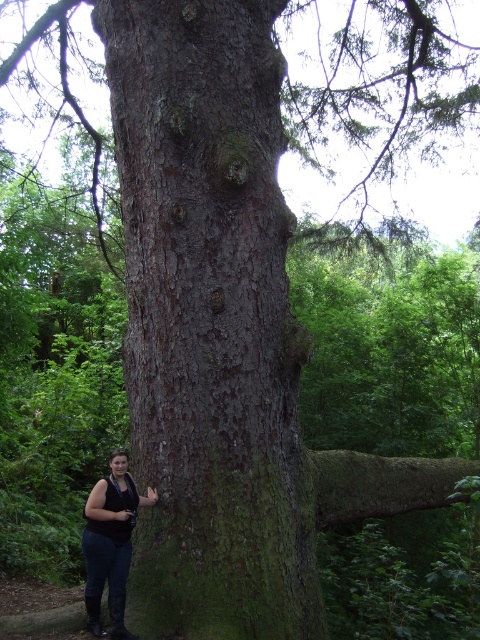
Looking at this image, you are standing in front of a large tree trunk with rough bark. There is a point marked at coordinates (211, 320). Based on the scene description, what part of the tree does this point most likely lie on?

The point at (211, 320) is on the dark brown rough bark at center, which is part of the large tree trunk described in the scene.

You are standing in a forest and see the dark brown rough bark at center and the matte black vest at lower left. Which object is positioned to the right side?

The dark brown rough bark at center is positioned to the right of the matte black vest at lower left.

You are a hiker who wants to take a photo of the dark brown rough bark at center and the matte black vest at lower left. Since you have a camera with a fixed focal length, you need to adjust your position to ensure both objects are in the frame. Considering their heights, which object should you focus on to include both in your shot?

The dark brown rough bark at center has a greater height compared to the matte black vest at lower left. To include both in the frame, you should focus on the dark brown rough bark at center since it is taller and requires a wider angle to capture its full height, ensuring the shorter matte black vest at lower left is also visible.